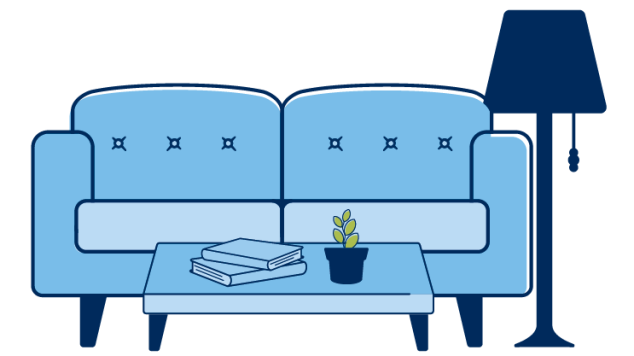
Identify the location of table leg. The height and width of the screenshot is (356, 634). (416, 334).